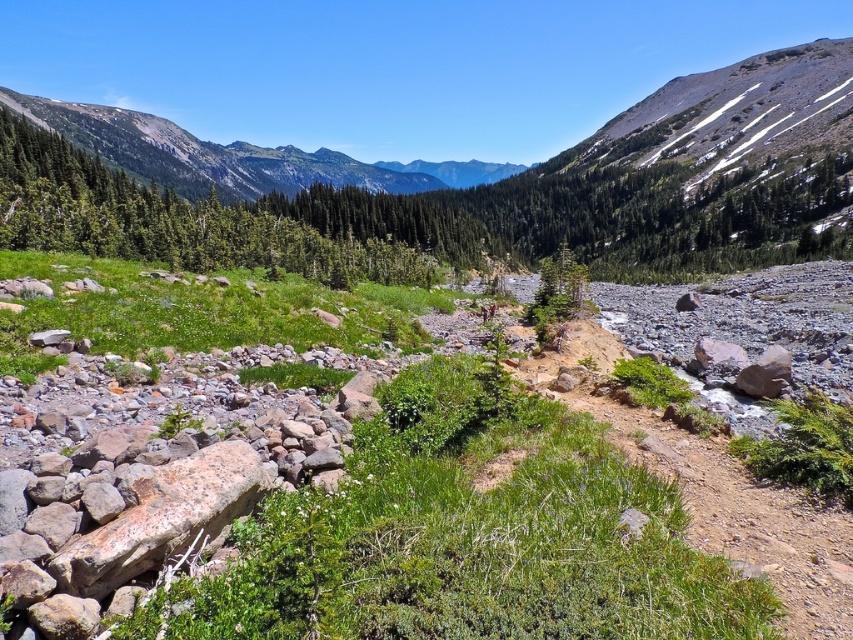
Can you confirm if green leafy tree at upper left is shorter than green forested mountain at upper center?

Yes, green leafy tree at upper left is shorter than green forested mountain at upper center.

Is green leafy tree at upper left positioned before green forested mountain at upper center?

Yes, it is.

Between point (198, 228) and point (134, 150), which one is positioned in front?

Point (198, 228) is in front.

What are the coordinates of `green leafy tree at upper left` in the screenshot? It's located at (167, 220).